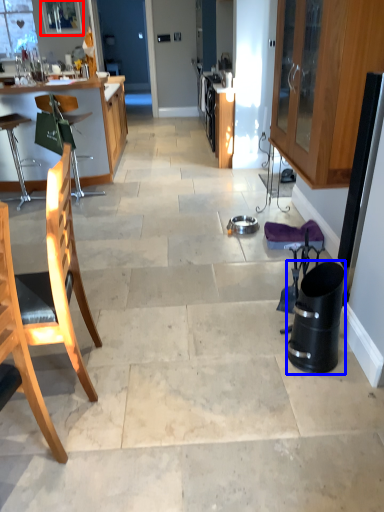
Question: Which object is closer to the camera taking this photo, window screen (highlighted by a red box) or trash bin/can (highlighted by a blue box)?

Choices:
 (A) window screen
 (B) trash bin/can

Answer: (B)